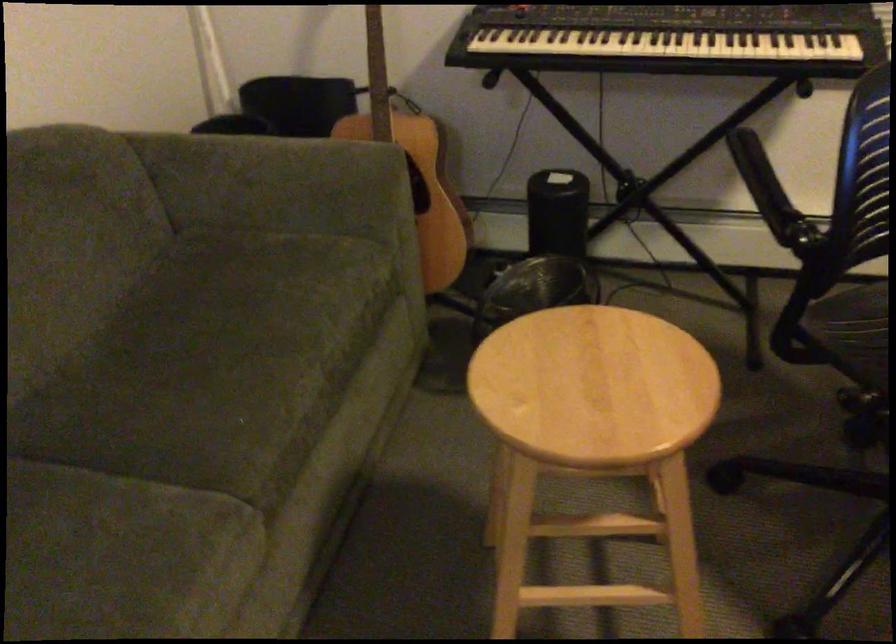
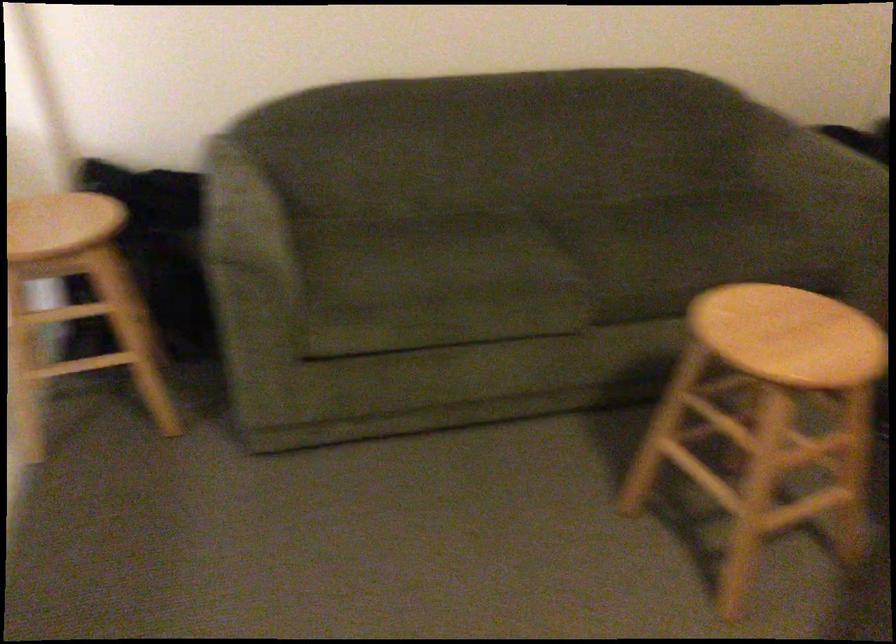
Locate, in the second image, the point that corresponds to the point at 590,384 in the first image.

(789, 335)